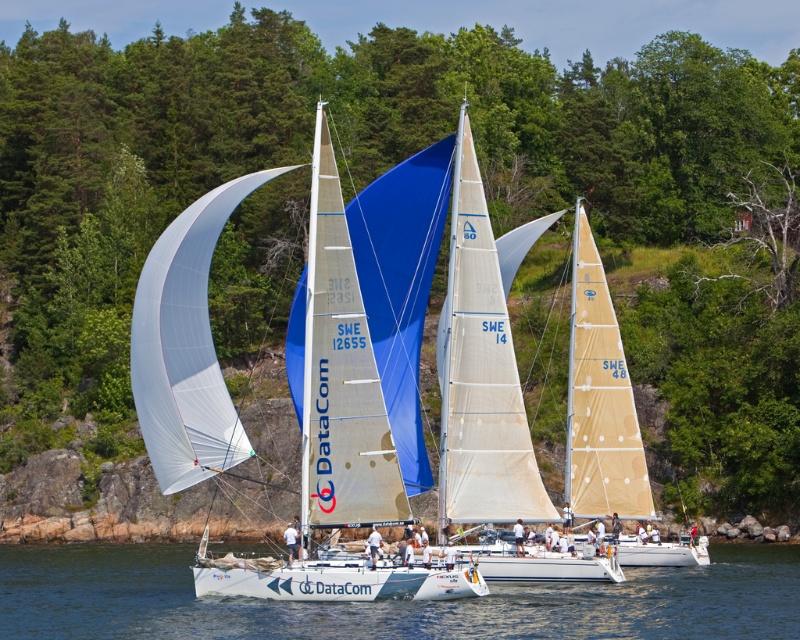
You are a photographer trying to capture a clear shot of the white matte sailboat at center. Since the boat is on the transparent water at center, will you need to adjust your camera focus to ensure the boat is sharp?

The white matte sailboat at center is positioned over transparent water at center, so the boat is on top of the water. You should focus on the boat itself to ensure it appears sharp in the photo.

You are standing on the deck of the boat with the white hull and want to grab an object located at point (194, 433) and another object at point (552, 627). Which point is closer to you?

Point (194, 433) is further to the camera than point (552, 627), so the point closer to you is point (552, 627).

You are a photographer trying to capture the white matte sailboat at center and the transparent water at center in a single shot. Based on their sizes in the image, which object would appear larger in the photo?

The white matte sailboat at center appears much larger in the photo because it is much taller than the transparent water at center.